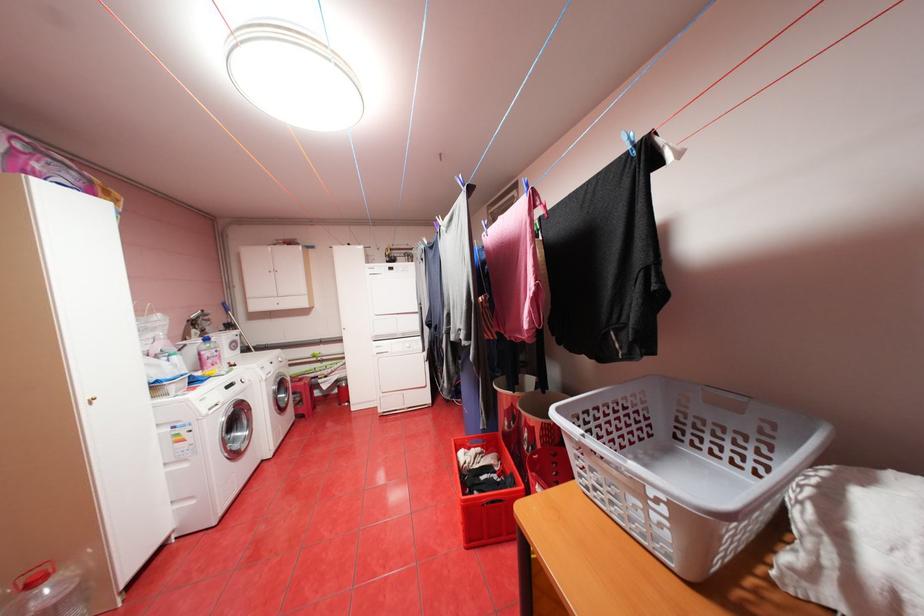
Find where to twist the pink bottle cap. Please return your answer as a coordinate pair (x, y).

(33, 576)